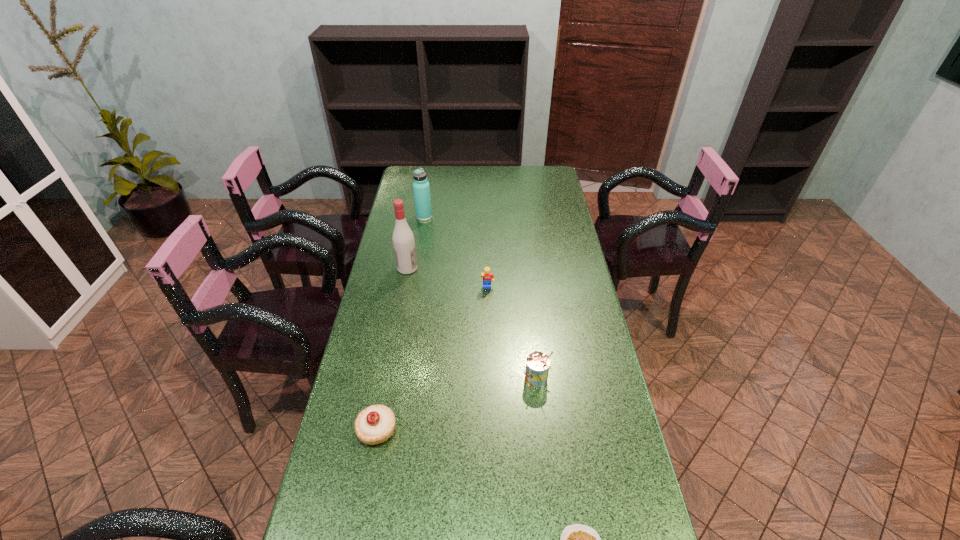
The image size is (960, 540). Find the location of `vacant region between the tallest object and the thermos bottle`. vacant region between the tallest object and the thermos bottle is located at coordinates (416, 242).

Locate an element on the screen. This screenshot has width=960, height=540. free spot between the fourth farthest object and the thermos bottle is located at coordinates (481, 298).

I want to click on free spot between the third nearest object and the pastry, so click(x=457, y=404).

The width and height of the screenshot is (960, 540). I want to click on blank region between the Lego and the thermos bottle, so pos(456,252).

Locate an element on the screen. Image resolution: width=960 pixels, height=540 pixels. vacant region between the pastry and the third tallest object is located at coordinates (457, 404).

Where is `vacant space that is in between the fifth shortest object and the can`? vacant space that is in between the fifth shortest object and the can is located at coordinates (481, 298).

You are a GUI agent. You are given a task and a screenshot of the screen. Output one action in this format:
    pyautogui.click(x=<x>, y=<y>)
    Task: Click on the vacant area that lies between the third tallest object and the alcohol
    The image size is (960, 540).
    Given the screenshot: What is the action you would take?
    pyautogui.click(x=472, y=323)

Image resolution: width=960 pixels, height=540 pixels. I want to click on the closest object to the shortest object, so click(x=537, y=366).

Locate an element on the screen. This screenshot has height=540, width=960. the second closest object relative to the thermos bottle is located at coordinates (488, 277).

You are a GUI agent. You are given a task and a screenshot of the screen. Output one action in this format:
    pyautogui.click(x=<x>, y=<y>)
    Task: Click on the vacant space that satisfies the following two spatial constraints: 1. on the label of the tallest object; 2. on the right side of the third tallest object
    This screenshot has width=960, height=540.
    Given the screenshot: What is the action you would take?
    pyautogui.click(x=387, y=379)